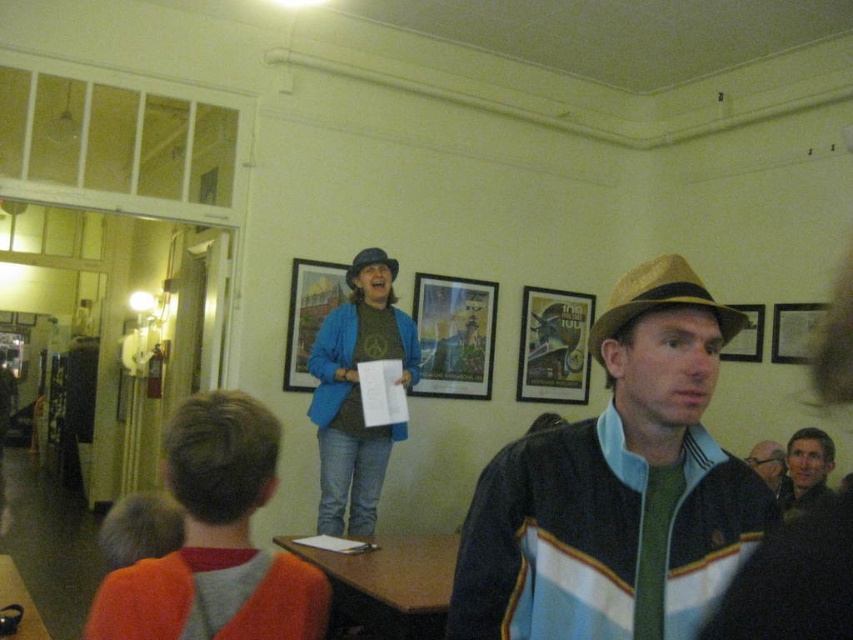
Question: Which of the following is the closest to the observer?

Choices:
 (A) blue cotton jacket at upper center
 (B) orange sweater at lower left
 (C) matte black sweater at center

Answer: (B)

Question: Can you confirm if matte brown hat at center is positioned below wooden picture frame at upper right?

Choices:
 (A) yes
 (B) no

Answer: (A)

Question: Which of these objects is positioned farthest from the metallic poster at center?

Choices:
 (A) orange sweater at lower left
 (B) gold textured cowboy hat at center
 (C) matte brown hat at center
 (D) matte black sweater at center

Answer: (C)

Question: Is blue cotton jacket at upper center further to camera compared to wooden framed poster at center?

Choices:
 (A) yes
 (B) no

Answer: (B)

Question: Which point is closer to the camera?

Choices:
 (A) (316, 289)
 (B) (328, 420)
 (C) (755, 312)

Answer: (B)

Question: Can you confirm if wooden framed poster at center is positioned above wooden picture frame at center?

Choices:
 (A) yes
 (B) no

Answer: (A)